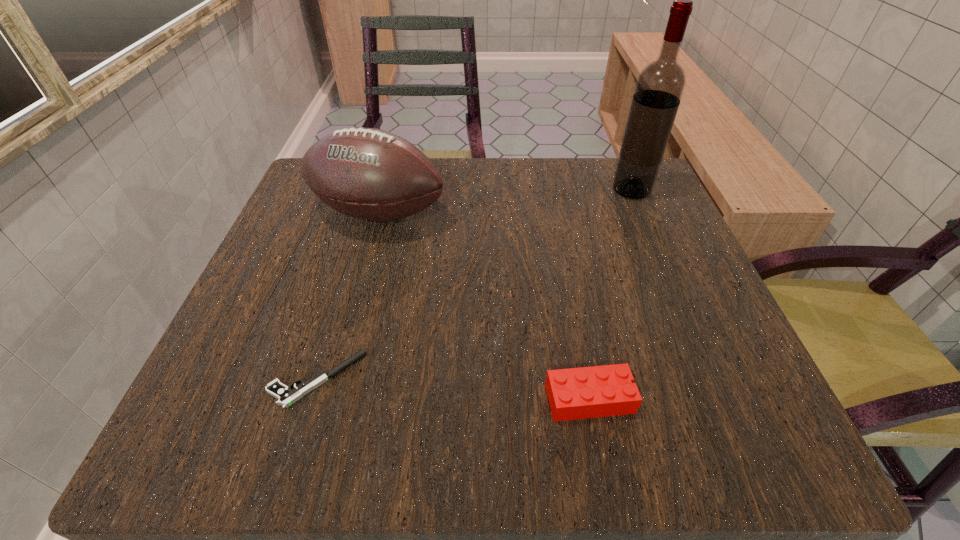
This screenshot has height=540, width=960. What are the coordinates of `vacant space at the near edge of the desktop` in the screenshot? It's located at (587, 423).

I want to click on vacant space at the left edge of the desktop, so click(x=322, y=310).

Where is `vacant space at the right edge of the desktop`? The height and width of the screenshot is (540, 960). vacant space at the right edge of the desktop is located at coordinates [x=695, y=272].

Locate an element on the screen. The image size is (960, 540). blank space at the near left corner is located at coordinates (274, 400).

In the image, there is a desktop. Where is `vacant space at the far right corner`? vacant space at the far right corner is located at coordinates (672, 220).

The image size is (960, 540). Find the location of `free spot between the shortest object and the rightmost object`. free spot between the shortest object and the rightmost object is located at coordinates (474, 285).

Where is `blank region between the pistol and the second tallest object`? The image size is (960, 540). blank region between the pistol and the second tallest object is located at coordinates (348, 296).

The width and height of the screenshot is (960, 540). What are the coordinates of `vacant space that's between the football (American) and the Lego` in the screenshot? It's located at (484, 306).

Where is `free area in between the pistol and the third tallest object`? The height and width of the screenshot is (540, 960). free area in between the pistol and the third tallest object is located at coordinates (453, 389).

Locate an element on the screen. The width and height of the screenshot is (960, 540). free space between the tallest object and the shortest object is located at coordinates (474, 285).